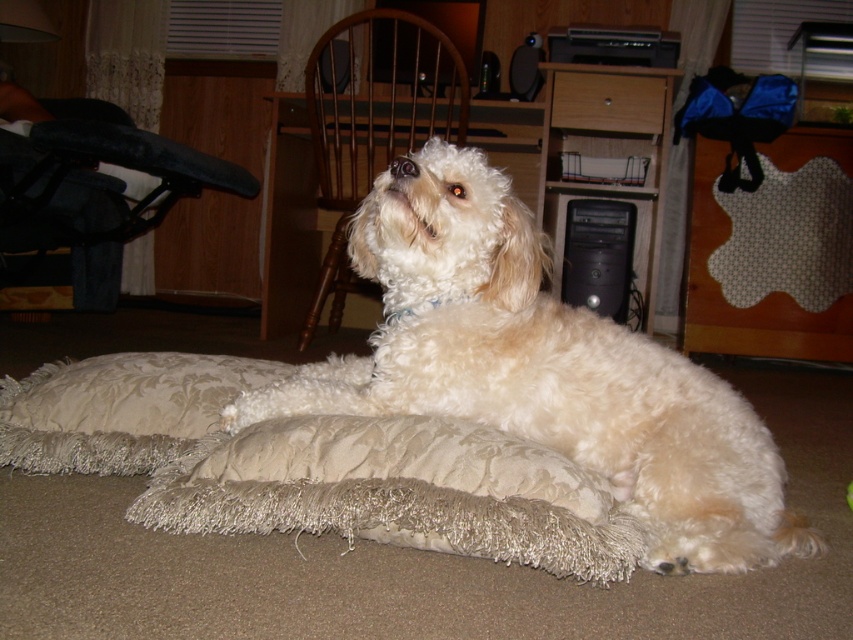
Question: Is white fluffy dog at center below beige shaggy pillow at lower center?

Choices:
 (A) no
 (B) yes

Answer: (B)

Question: Estimate the real-world distances between objects in this image. Which object is closer to the beige shaggy pillow at lower center?

Choices:
 (A) white fluffy dog at center
 (B) beige fabric dog bed at lower center

Answer: (B)

Question: Is white fluffy dog at center positioned at the back of beige shaggy pillow at lower center?

Choices:
 (A) yes
 (B) no

Answer: (B)

Question: Which object is farther from the camera taking this photo?

Choices:
 (A) beige fabric dog bed at lower center
 (B) beige shaggy pillow at lower center

Answer: (B)

Question: Estimate the real-world distances between objects in this image. Which object is farther from the beige fabric dog bed at lower center?

Choices:
 (A) beige shaggy pillow at lower center
 (B) white fluffy dog at center

Answer: (B)

Question: Does beige fabric dog bed at lower center come behind beige shaggy pillow at lower center?

Choices:
 (A) yes
 (B) no

Answer: (B)